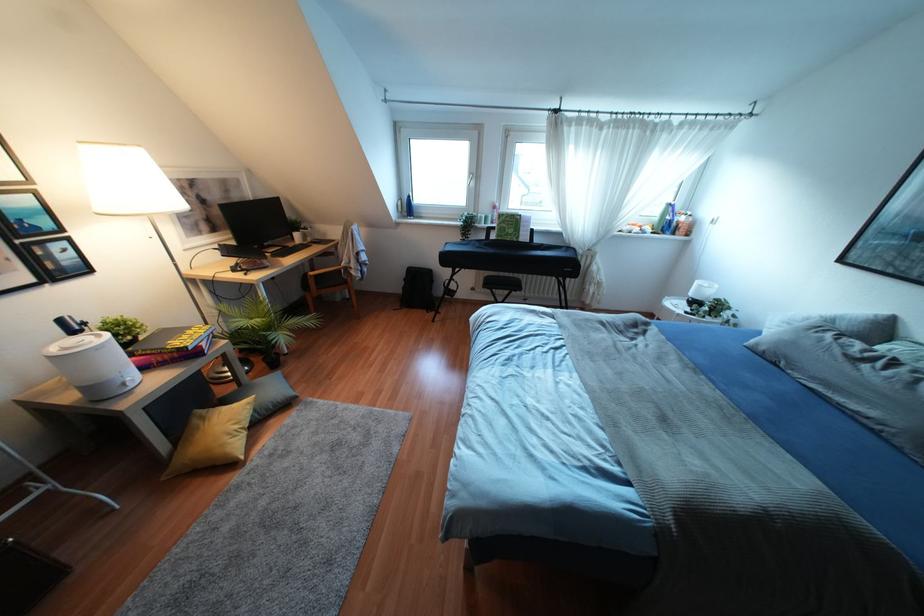
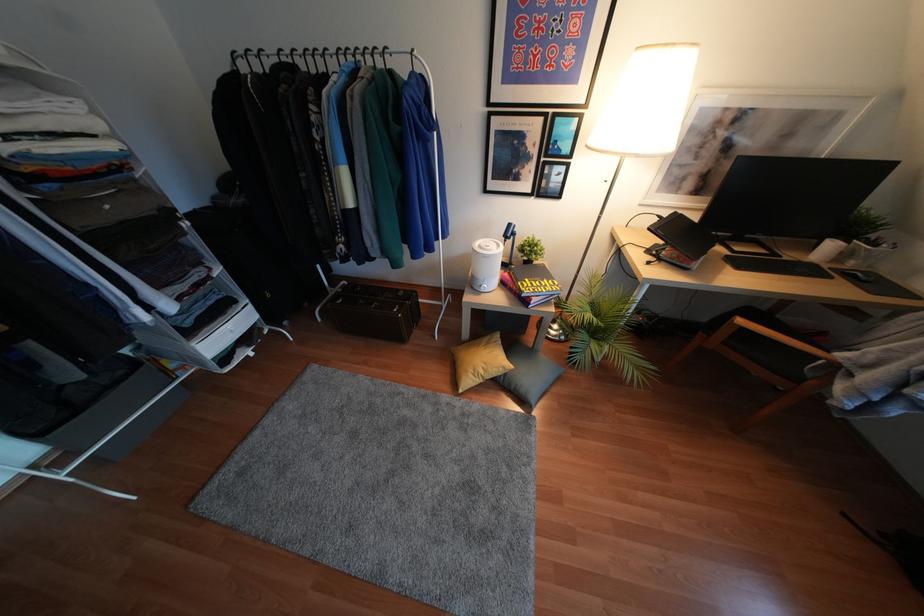
Find the pixel in the second image that matches point (290, 330) in the first image.

(604, 357)